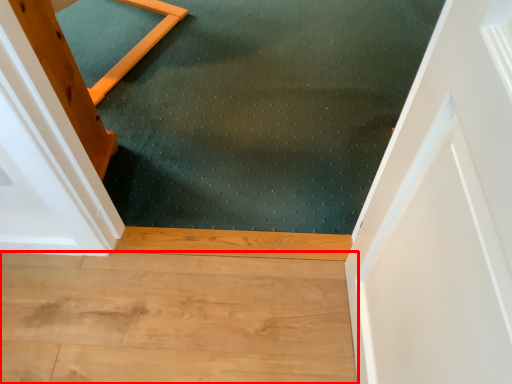
Question: From the image's perspective, what is the correct spatial positioning of hardwood (annotated by the red box) in reference to mat?

Choices:
 (A) below
 (B) above

Answer: (A)